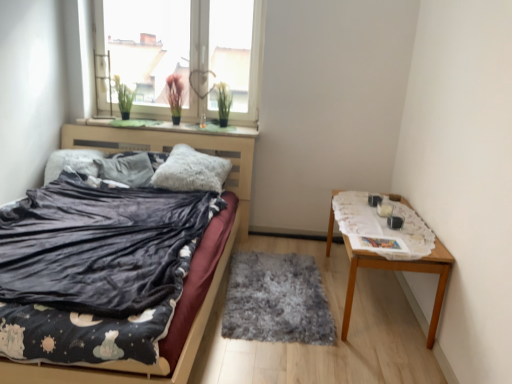
The width and height of the screenshot is (512, 384). I want to click on empty space that is to the right of fuzzy gray rug at center, so click(366, 307).